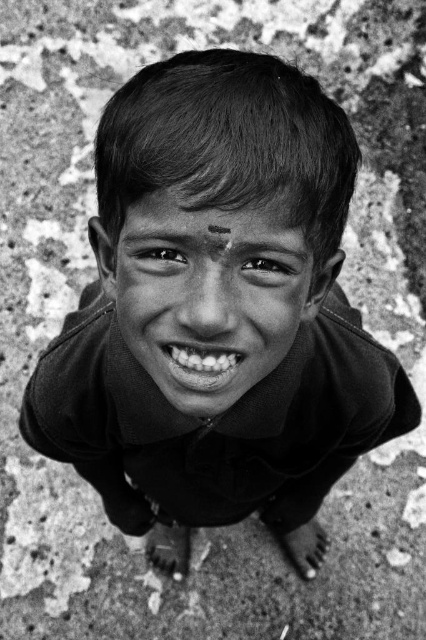
Question: Among these objects, which one is farthest from the camera?

Choices:
 (A) black matte face at center
 (B) white glossy teeth at center

Answer: (B)

Question: Which object appears farthest from the camera in this image?

Choices:
 (A) black matte face at center
 (B) white glossy teeth at center

Answer: (B)

Question: Can you confirm if black matte face at center is wider than white glossy teeth at center?

Choices:
 (A) no
 (B) yes

Answer: (B)

Question: Which of the following is the farthest from the observer?

Choices:
 (A) (290, 237)
 (B) (192, 358)

Answer: (B)

Question: Is black matte face at center to the right of white glossy teeth at center from the viewer's perspective?

Choices:
 (A) yes
 (B) no

Answer: (A)

Question: Is black matte face at center smaller than white glossy teeth at center?

Choices:
 (A) yes
 (B) no

Answer: (B)